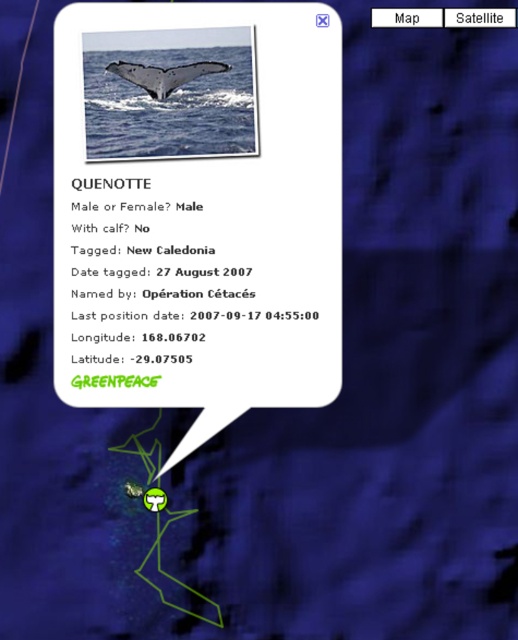
Based on the scene description, can you determine the distance between the black paper text at upper center and the gray matte whale tail at upper center?

The distance between the black paper text at upper center and the gray matte whale tail at upper center is 5.78 inches.

Based on the image described, which object is positioned higher between the black paper text at upper center and the gray matte whale tail at upper center?

The gray matte whale tail at upper center is positioned higher than the black paper text at upper center.

You are a marine biologist observing QUENOTTE through a submarine window. The submarine window is 60 centimeters wide. Can you fit the blue water at tail right into your view without moving the submarine?

The blue water at tail right is 56.75 centimeters away from the viewer, which is narrower than the submarine window width of 60 centimeters. Therefore, the blue water at tail right can fit within the view without moving the submarine.